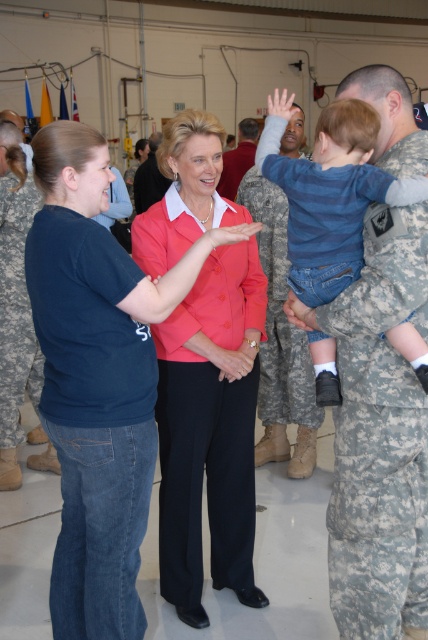
Based on the scene description, where is the denim jeans at left located in the image?

The denim jeans at left is located at the point with coordinates 0.658 in the x dimension and 0.220 in the y dimension.

You are a photographer taking a picture of the camouflage fabric uniform at right and the blue denim jeans at center. Which object should you focus on first to ensure both are in focus without moving the camera?

You should focus on the camouflage fabric uniform at right first because the blue denim jeans at center is behind it, so focusing on the closer object will keep both in focus.